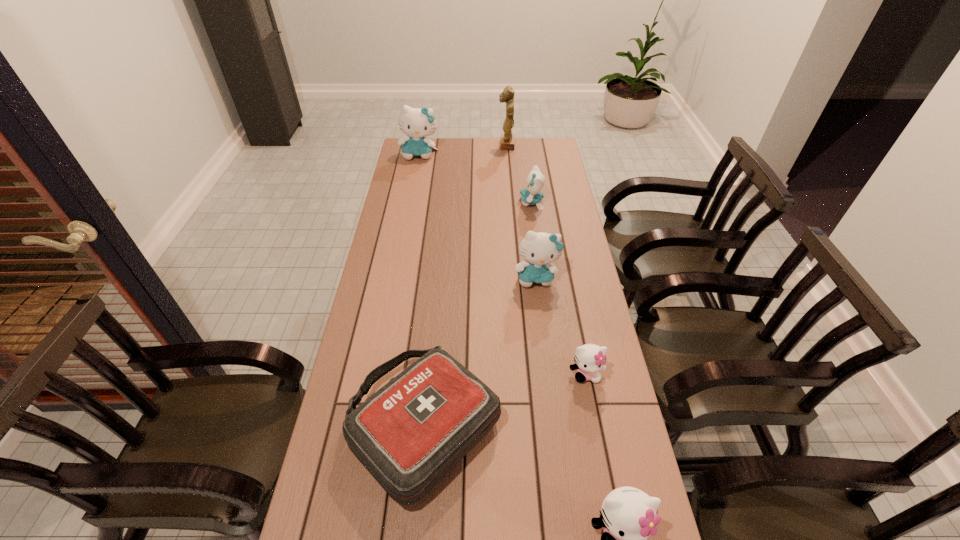
Find the location of a particular element. The height and width of the screenshot is (540, 960). figurine that is at the far edge is located at coordinates (507, 139).

Locate an element on the screen. This screenshot has width=960, height=540. kitten located at the far edge is located at coordinates (417, 123).

The height and width of the screenshot is (540, 960). I want to click on kitten at the left edge, so coord(417,123).

This screenshot has height=540, width=960. Identify the location of the first-aid kit positioned at the left edge. (x=409, y=434).

Image resolution: width=960 pixels, height=540 pixels. In order to click on object present at the far left corner in this screenshot , I will do `click(417, 123)`.

The image size is (960, 540). I want to click on free space at the left edge of the desktop, so click(x=389, y=196).

The image size is (960, 540). What are the coordinates of `vacant space at the right edge` in the screenshot? It's located at (575, 401).

Identify the location of vacant space at the far right corner. (549, 157).

At what (x,y) coordinates should I click in order to perform the action: click on vacant area that lies between the first-aid kit and the tallest object. Please return your answer as a coordinate pair (x, y). The image size is (960, 540). Looking at the image, I should click on (466, 285).

Locate an element on the screen. The height and width of the screenshot is (540, 960). free space between the figurine and the leftmost kitten is located at coordinates (463, 150).